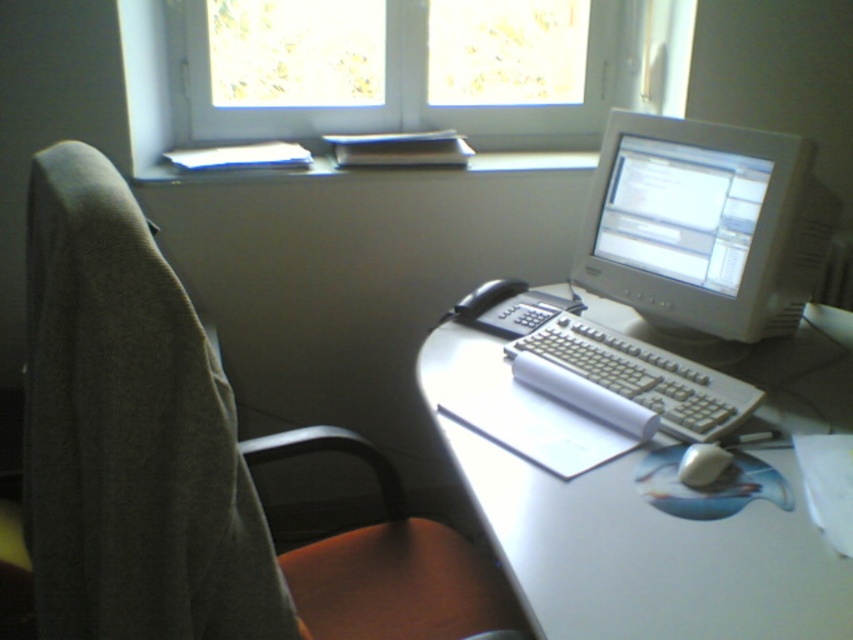
Question: Does white plastic monitor at upper right have a lesser width compared to white plastic keyboard at center?

Choices:
 (A) yes
 (B) no

Answer: (B)

Question: Which of the following is the closest to the observer?

Choices:
 (A) (552, 336)
 (B) (527, 497)
 (C) (762, 157)
 (D) (163, 344)

Answer: (D)

Question: Which point is closer to the camera taking this photo?

Choices:
 (A) (132, 52)
 (B) (689, 477)
 (C) (677, 236)

Answer: (B)

Question: Is white plastic monitor at upper right closer to camera compared to white plastic keyboard at center?

Choices:
 (A) no
 (B) yes

Answer: (A)

Question: Is white plastic monitor at upper right smaller than white glossy monitor at upper right?

Choices:
 (A) no
 (B) yes

Answer: (A)

Question: Estimate the real-world distances between objects in this image. Which object is farther from the white glossy monitor at upper right?

Choices:
 (A) white plastic keyboard at center
 (B) white matte mouse at lower right
 (C) fabric swivel chair at left

Answer: (C)